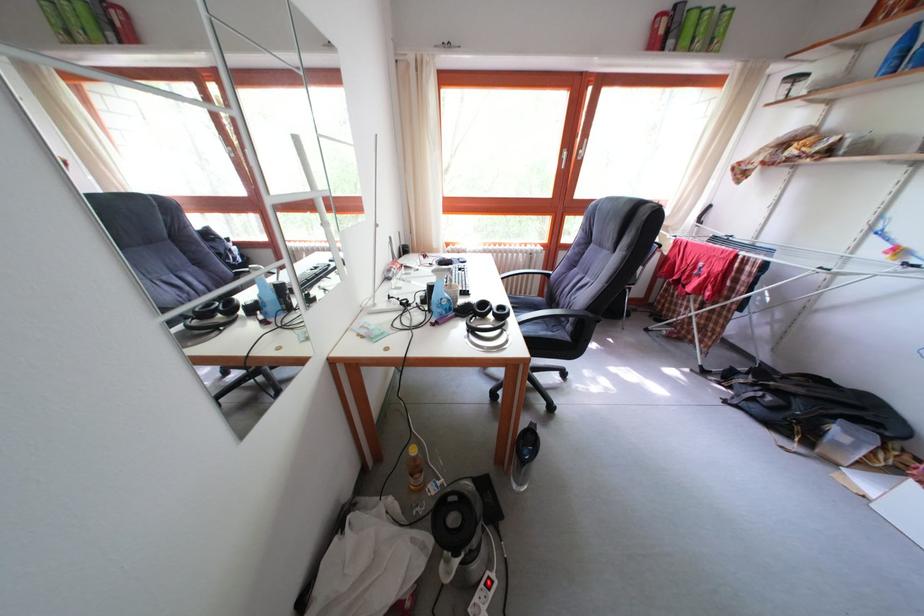
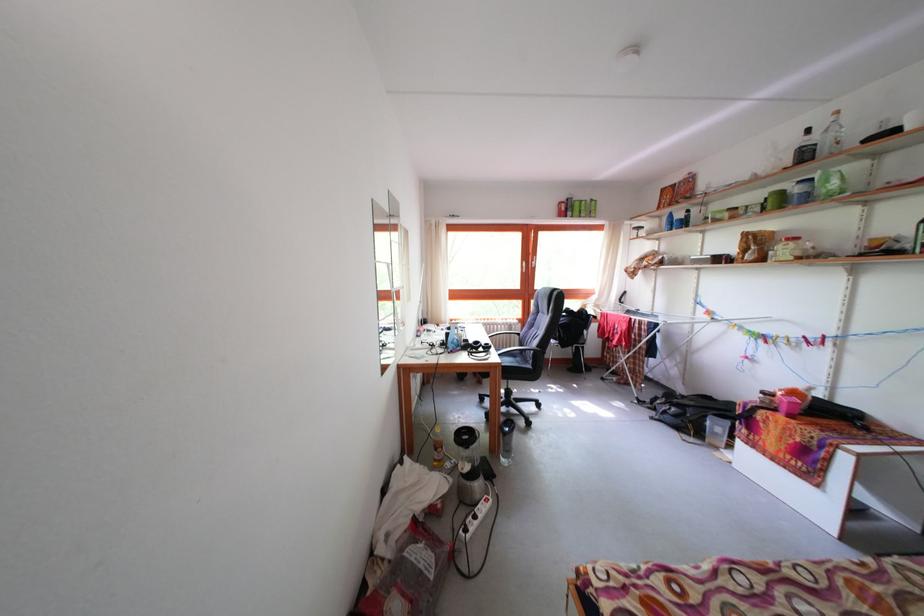
Question: Based on the continuous images, in which direction is the camera rotating? Reply with the corresponding letter.

Choices:
 (A) Left
 (B) Right
 (C) Up
 (D) Down

Answer: (C)